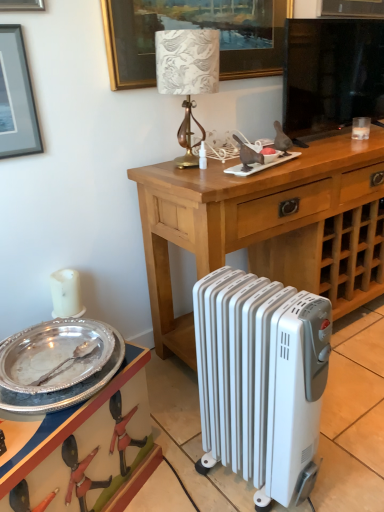
Image resolution: width=384 pixels, height=512 pixels. Identify the location of vacant space to the left of white metallic radiator at lower center. (185, 465).